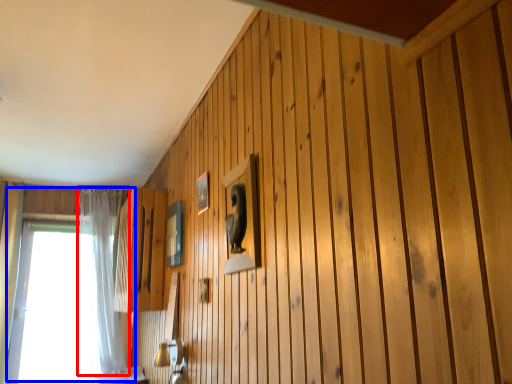
Question: Which object appears closest to the camera in this image, curtain (highlighted by a red box) or window (highlighted by a blue box)?

Choices:
 (A) curtain
 (B) window

Answer: (A)